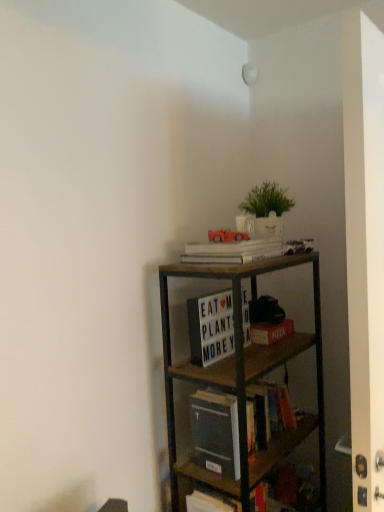
Question: Considering the relative sizes of white matte letter board at center, positioned as the second book in top-to-bottom order, and matte red car at upper center in the image provided, is white matte letter board at center, positioned as the second book in top-to-bottom order, shorter than matte red car at upper center?

Choices:
 (A) no
 (B) yes

Answer: (A)

Question: Can matte red car at upper center be found inside white matte letter board at center, positioned as the second book in top-to-bottom order?

Choices:
 (A) yes
 (B) no

Answer: (B)

Question: Considering the relative sizes of white matte letter board at center, which appears as the 2th book when ordered from the bottom, and matte red car at upper center in the image provided, is white matte letter board at center, which appears as the 2th book when ordered from the bottom, taller than matte red car at upper center?

Choices:
 (A) yes
 (B) no

Answer: (A)

Question: From a real-world perspective, is white matte letter board at center, which appears as the 2th book when ordered from the bottom, located higher than matte red car at upper center?

Choices:
 (A) yes
 (B) no

Answer: (B)

Question: Considering the relative positions of white matte letter board at center, positioned as the second book in top-to-bottom order, and matte red car at upper center in the image provided, is white matte letter board at center, positioned as the second book in top-to-bottom order, to the right of matte red car at upper center from the viewer's perspective?

Choices:
 (A) yes
 (B) no

Answer: (B)

Question: Is white matte letter board at center, positioned as the second book in top-to-bottom order, outside of matte red car at upper center?

Choices:
 (A) no
 (B) yes

Answer: (B)

Question: Considering the relative positions of green matte plant at upper center and hardcover book at center, acting as the first book starting from the bottom, in the image provided, is green matte plant at upper center to the left of hardcover book at center, acting as the first book starting from the bottom, from the viewer's perspective?

Choices:
 (A) yes
 (B) no

Answer: (B)

Question: Considering the relative sizes of green matte plant at upper center and hardcover book at center, acting as the first book starting from the bottom, in the image provided, is green matte plant at upper center shorter than hardcover book at center, acting as the first book starting from the bottom,?

Choices:
 (A) no
 (B) yes

Answer: (A)

Question: Is the depth of green matte plant at upper center less than that of hardcover book at center, placed as the 3th book when sorted from top to bottom?

Choices:
 (A) no
 (B) yes

Answer: (A)

Question: Is hardcover book at center, acting as the first book starting from the bottom, at the back of green matte plant at upper center?

Choices:
 (A) yes
 (B) no

Answer: (B)

Question: From the image's perspective, is green matte plant at upper center located above hardcover book at center, placed as the 3th book when sorted from top to bottom?

Choices:
 (A) no
 (B) yes

Answer: (B)

Question: Considering the relative positions of green matte plant at upper center and hardcover book at center, placed as the 3th book when sorted from top to bottom, in the image provided, is green matte plant at upper center to the right of hardcover book at center, placed as the 3th book when sorted from top to bottom, from the viewer's perspective?

Choices:
 (A) yes
 (B) no

Answer: (A)

Question: Can you confirm if matte red car at upper center is taller than white matte letter board at center, which appears as the 2th book when ordered from the bottom?

Choices:
 (A) no
 (B) yes

Answer: (A)